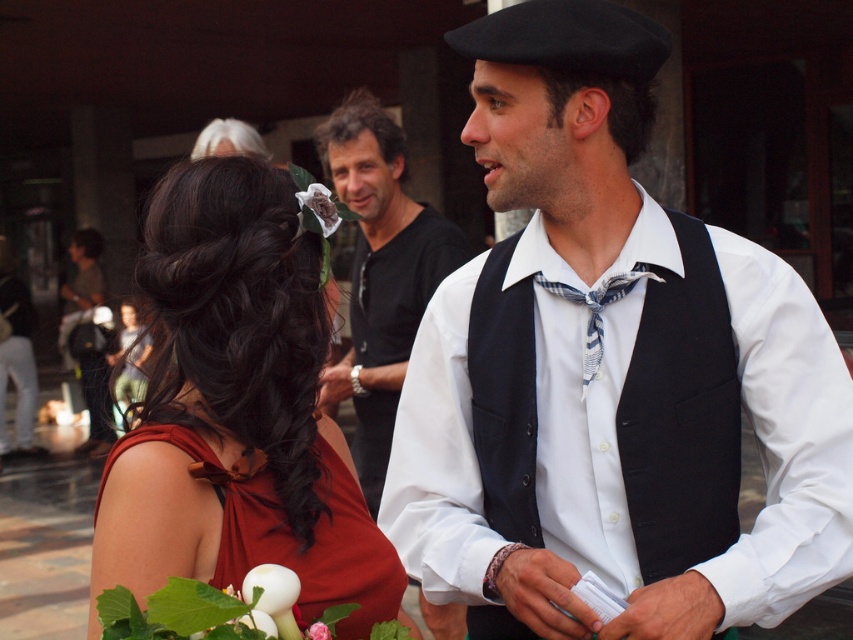
Is matte black vest at center thinner than black wool vest at center?

No, matte black vest at center is not thinner than black wool vest at center.

In the scene shown: Who is positioned more to the left, matte black vest at center or black wool vest at center?

From the viewer's perspective, matte black vest at center appears more on the left side.

Describe the element at coordinates (608, 372) in the screenshot. This screenshot has height=640, width=853. I see `matte black vest at center` at that location.

Identify the location of matte black vest at center. (608, 372).

Between white cotton shirt at center and pink fabric flower at center, which one appears on the left side from the viewer's perspective?

white cotton shirt at center is more to the left.

Does white cotton shirt at center have a smaller size compared to pink fabric flower at center?

No, white cotton shirt at center is not smaller than pink fabric flower at center.

Is point (370, 172) positioned before point (314, 632)?

No, it is not.

This screenshot has height=640, width=853. Identify the location of white cotton shirt at center. (380, 273).

Does white matte flower at center have a greater height compared to pink fabric flower at center?

Yes.

Can you confirm if white matte flower at center is smaller than pink fabric flower at center?

Actually, white matte flower at center might be larger than pink fabric flower at center.

Does point (323, 236) come in front of point (309, 636)?

That is False.

Locate an element on the screen. The width and height of the screenshot is (853, 640). white matte flower at center is located at coordinates (320, 205).